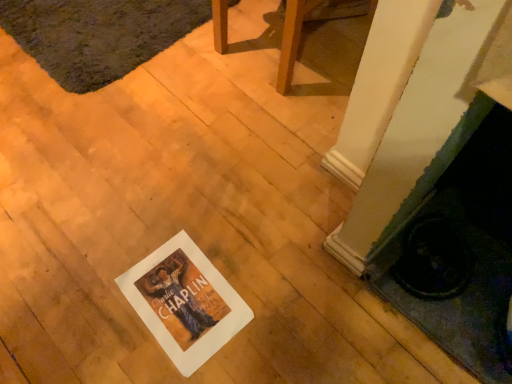
Locate an element on the screen. This screenshot has height=384, width=512. vacant space underneath white paper at center (from a real-world perspective) is located at coordinates click(x=189, y=299).